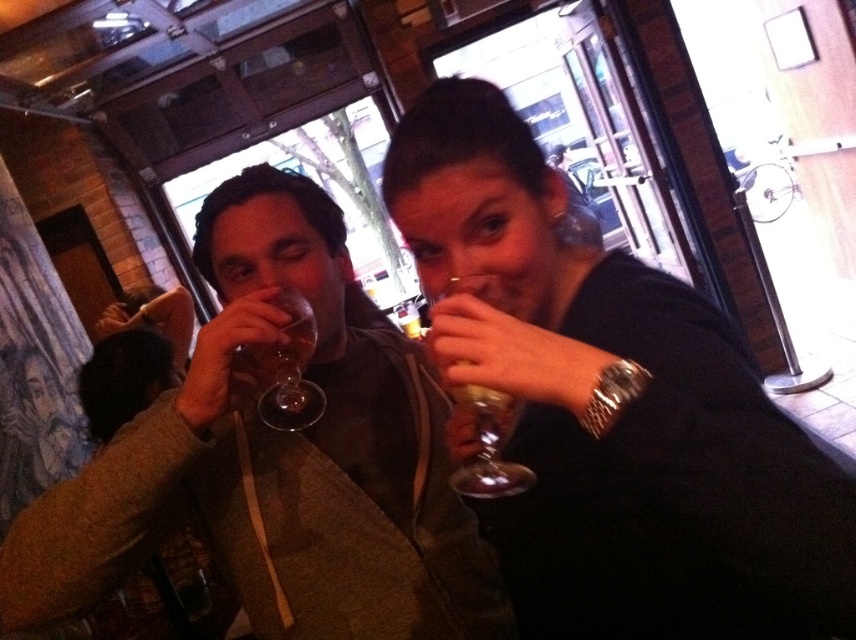
Which is more to the right, black leather jacket at upper right or transparent glass wine glass at center?

black leather jacket at upper right is more to the right.

Who is more forward, (638, 260) or (305, 413)?

Point (638, 260) is more forward.

I want to click on black leather jacket at upper right, so click(611, 406).

Can you confirm if black leather jacket at upper right is positioned to the right of transparent glass at upper center?

Correct, you'll find black leather jacket at upper right to the right of transparent glass at upper center.

In the scene shown: Who is more forward, (518, 298) or (470, 403)?

Point (470, 403) is in front.

The image size is (856, 640). Find the location of `black leather jacket at upper right`. black leather jacket at upper right is located at coordinates (611, 406).

What do you see at coordinates (270, 458) in the screenshot?
I see `matte glass wine glass at center` at bounding box center [270, 458].

How distant is matte glass wine glass at center from transparent glass wine glass at center?

The distance of matte glass wine glass at center from transparent glass wine glass at center is 5.02 inches.

Does point (119, 426) lie in front of point (298, 323)?

No.

You are a GUI agent. You are given a task and a screenshot of the screen. Output one action in this format:
    pyautogui.click(x=<x>, y=<y>)
    Task: Click on the matte glass wine glass at center
    Image resolution: width=856 pixels, height=640 pixels.
    Given the screenshot: What is the action you would take?
    pyautogui.click(x=270, y=458)